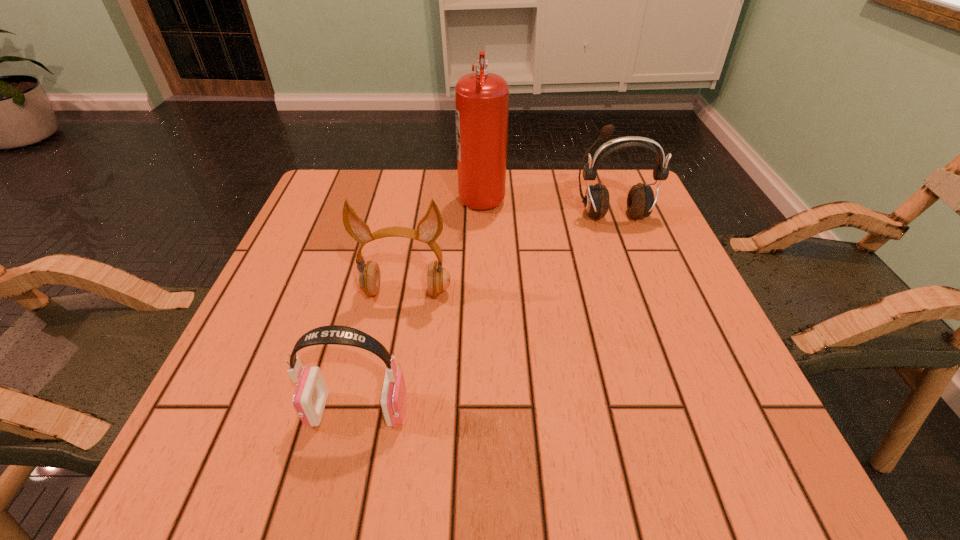
Locate an element on the screen. free space at the left edge of the desktop is located at coordinates (297, 258).

Locate an element on the screen. The height and width of the screenshot is (540, 960). vacant area at the right edge is located at coordinates (655, 338).

Locate an element on the screen. free location at the far left corner of the desktop is located at coordinates (323, 176).

In the image, there is a desktop. Where is `vacant space at the far right corner`? vacant space at the far right corner is located at coordinates (617, 190).

Image resolution: width=960 pixels, height=540 pixels. Find the location of `vacant area that lies between the farthest earphone and the tallest object`. vacant area that lies between the farthest earphone and the tallest object is located at coordinates (547, 205).

Image resolution: width=960 pixels, height=540 pixels. Find the location of `free area in between the farthest earphone and the second nearest object`. free area in between the farthest earphone and the second nearest object is located at coordinates (509, 254).

At what (x,y) coordinates should I click in order to perform the action: click on vacant area between the third farthest object and the rightmost object. Please return your answer as a coordinate pair (x, y). Looking at the image, I should click on (509, 254).

Image resolution: width=960 pixels, height=540 pixels. Find the location of `free space between the farthest earphone and the third object from left to right`. free space between the farthest earphone and the third object from left to right is located at coordinates (547, 205).

Where is `vacant space that's between the second nearest earphone and the rightmost earphone`? vacant space that's between the second nearest earphone and the rightmost earphone is located at coordinates click(509, 254).

Identify the location of vacant space in between the third farthest object and the tallest object. (444, 244).